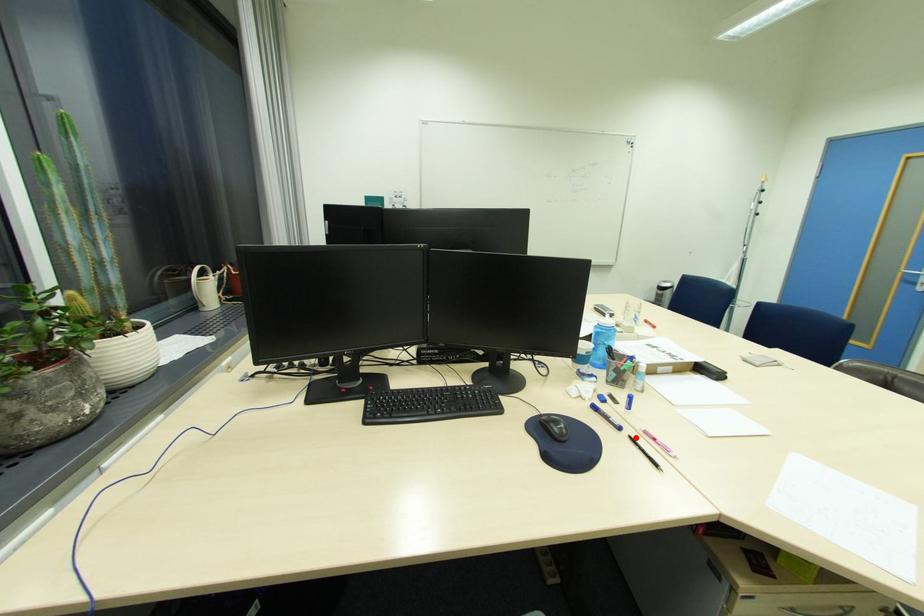
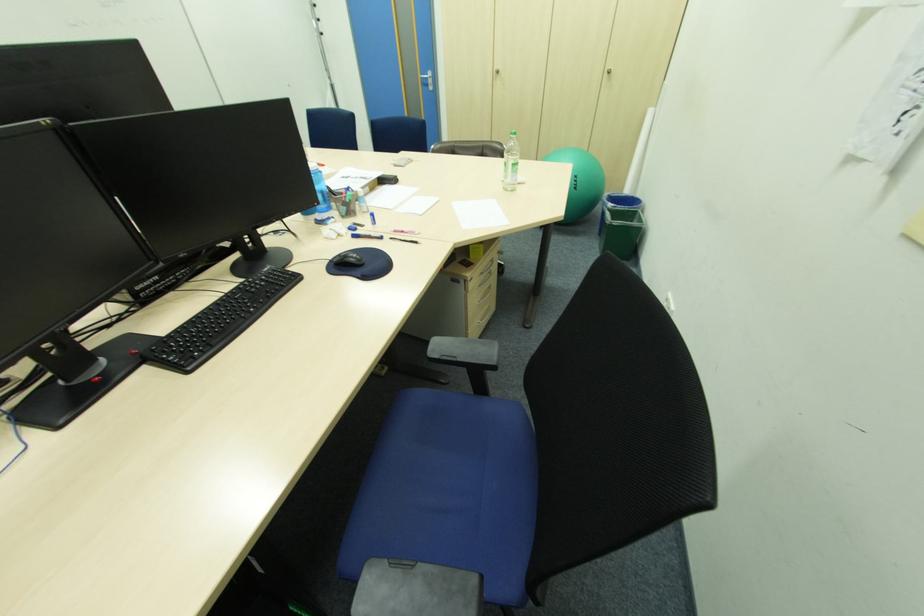
The point at the highlighted location is marked in the first image. Where is the corresponding point in the second image?

(396, 238)